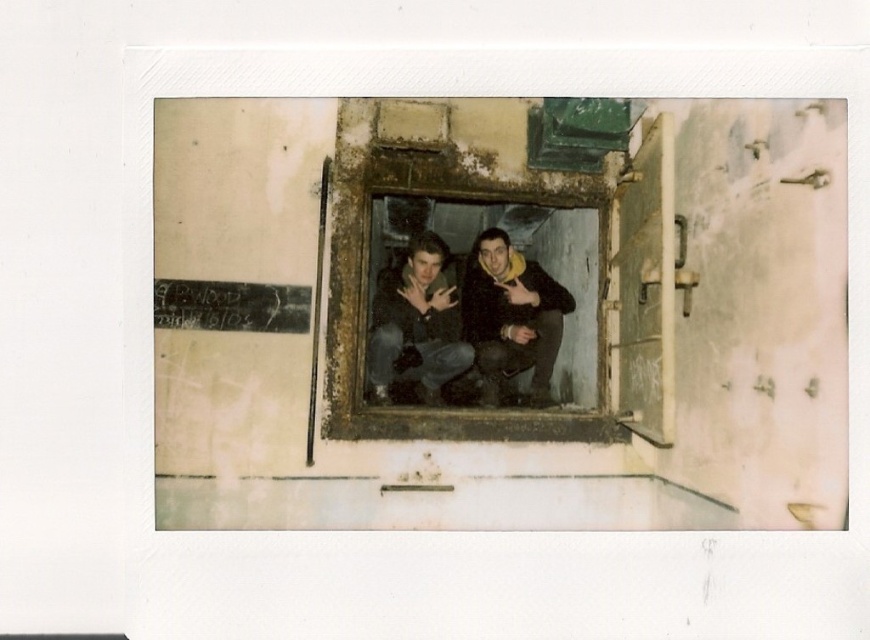
Question: Does dark blue jeans at center have a larger size compared to dark gray jeans at center?

Choices:
 (A) yes
 (B) no

Answer: (A)

Question: Does dark blue jeans at center come in front of dark gray jeans at center?

Choices:
 (A) no
 (B) yes

Answer: (A)

Question: Is dark blue jeans at center above dark gray jeans at center?

Choices:
 (A) no
 (B) yes

Answer: (B)

Question: Which point is farther from the camera taking this photo?

Choices:
 (A) (371, 320)
 (B) (435, 237)

Answer: (B)